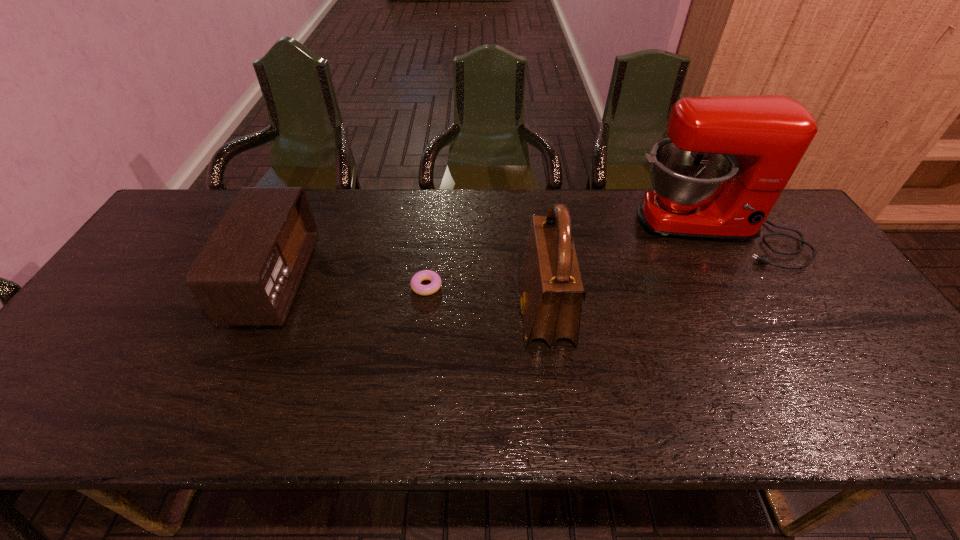
Where is `object that is the third closest to the leftmost object`? This screenshot has width=960, height=540. object that is the third closest to the leftmost object is located at coordinates (727, 160).

You are a GUI agent. You are given a task and a screenshot of the screen. Output one action in this format:
    pyautogui.click(x=<x>, y=<y>)
    Task: Click on the free spot that satisfies the following two spatial constraints: 1. on the front-facing side of the rightmost object; 2. on the front flap of the second object from right to left
    The image size is (960, 540).
    Given the screenshot: What is the action you would take?
    pyautogui.click(x=758, y=312)

Where is `vacant space that satisfies the following two spatial constraints: 1. on the front-facing side of the rightmost object; 2. on the front-facing side of the leftmost object`? The image size is (960, 540). vacant space that satisfies the following two spatial constraints: 1. on the front-facing side of the rightmost object; 2. on the front-facing side of the leftmost object is located at coordinates (740, 281).

The height and width of the screenshot is (540, 960). I want to click on free space in the image that satisfies the following two spatial constraints: 1. on the back side of the third object from right to left; 2. on the front-facing side of the leftmost object, so point(427,281).

Locate an element on the screen. This screenshot has width=960, height=540. free space that satisfies the following two spatial constraints: 1. on the front-facing side of the leftmost object; 2. on the back side of the shortest object is located at coordinates (273, 286).